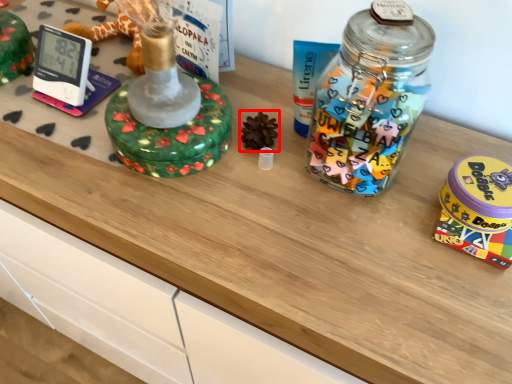
Question: From the image's perspective, what is the correct spatial relationship of toy (annotated by the red box) in relation to toy?

Choices:
 (A) below
 (B) above

Answer: (B)